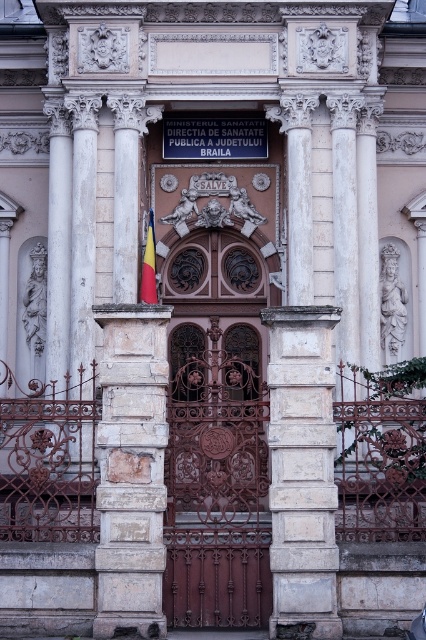
You are standing at the entrance of the historical building and want to take a photo that includes both the white stone column at center and the polished wood flag at center. Based on their positions, which object should you ensure is in the foreground to capture both clearly?

The white stone column at center is closer to the viewer than the polished wood flag at center, so you should position the camera so the white stone column at center is in the foreground to ensure both are in focus.